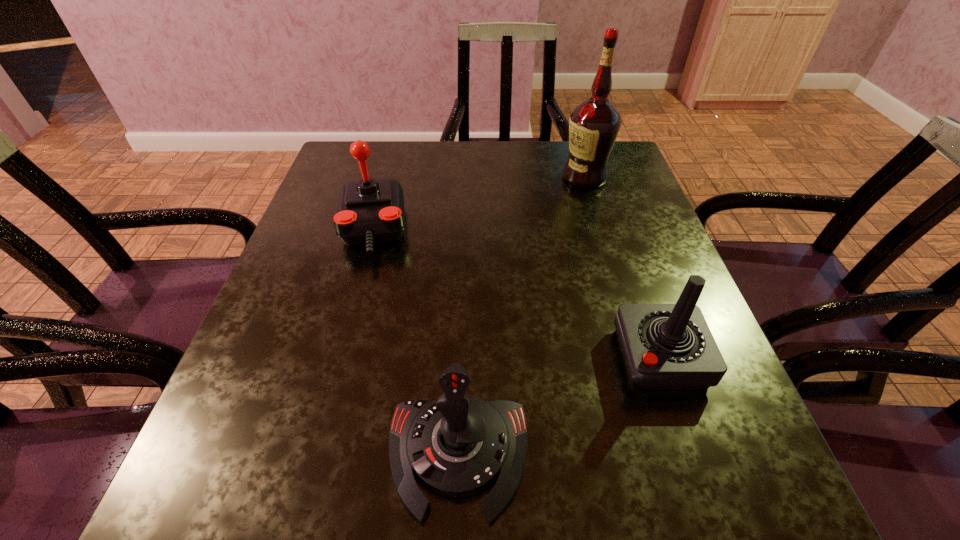
What are the coordinates of `joystick that is the second closest to the alcohol` in the screenshot? It's located at (665, 346).

Identify the location of free space that satisfies the following two spatial constraints: 1. on the label of the farthest object; 2. on the handle side of the nearest object. The height and width of the screenshot is (540, 960). (670, 456).

This screenshot has height=540, width=960. What are the coordinates of `free space that satisfies the following two spatial constraints: 1. on the front-facing side of the rightmost joystick; 2. on the handle side of the shortest object` in the screenshot? It's located at (693, 456).